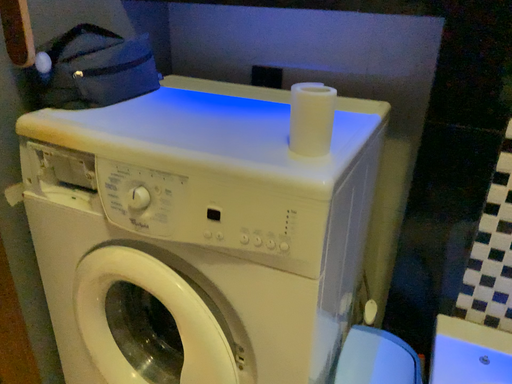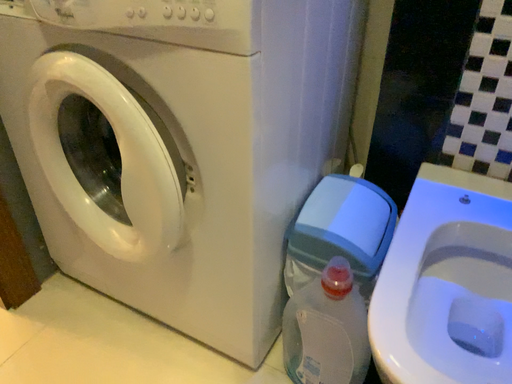
Question: Which way did the camera rotate in the video?

Choices:
 (A) rotated downward
 (B) rotated upward

Answer: (A)